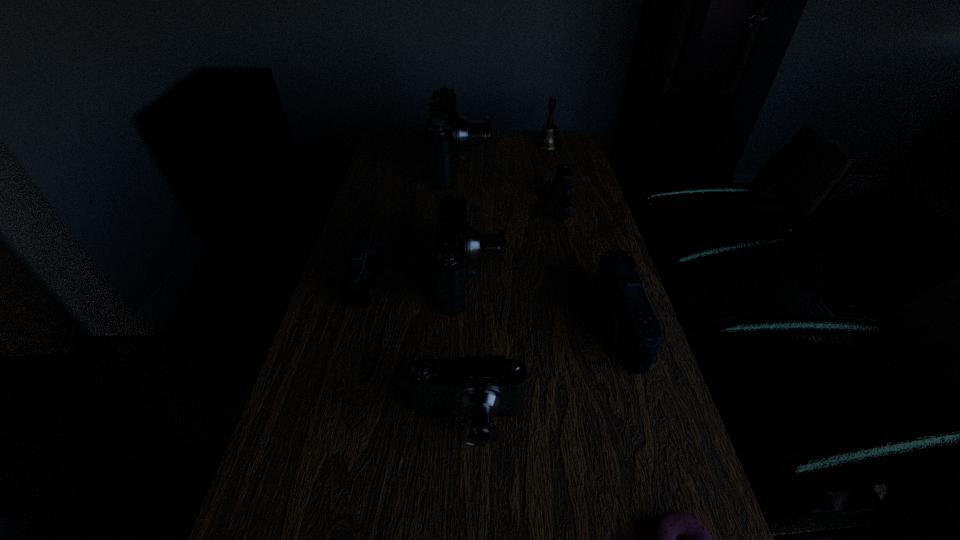
What are the coordinates of `the smallest blue camcorder` in the screenshot? It's located at (479, 389).

Identify the location of the left black camcorder. (365, 266).

Image resolution: width=960 pixels, height=540 pixels. What are the coordinates of `the leftmost camcorder` in the screenshot? It's located at (365, 266).

I want to click on free space located on the front-facing side of the farthest camcorder, so click(x=540, y=163).

Where is `free space located on the front of the bell`? free space located on the front of the bell is located at coordinates (556, 179).

Locate an element on the screen. The width and height of the screenshot is (960, 540). free space located 0.230m on the front-facing side of the second nearest blue camcorder is located at coordinates (590, 274).

Find the location of a particular element. Image resolution: width=960 pixels, height=540 pixels. vacant space located 0.230m on the ear cup of the sixth nearest object is located at coordinates (479, 211).

At what (x,y) coordinates should I click in order to perform the action: click on free location located on the ear cup of the sixth nearest object. Please return your answer as a coordinate pair (x, y). The width and height of the screenshot is (960, 540). Looking at the image, I should click on (492, 211).

The height and width of the screenshot is (540, 960). I want to click on free space located on the ear cup of the sixth nearest object, so click(514, 211).

What are the coordinates of `free space located on the front-facing side of the right black camcorder` in the screenshot? It's located at (445, 325).